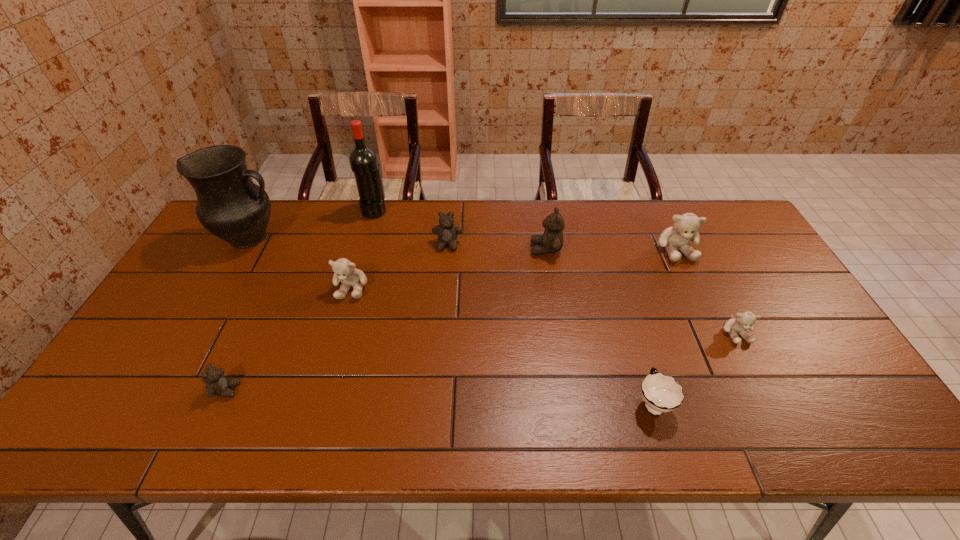
Identify which object is located as the seventh nearest to the biggest gray teddy bear. Please provide its 2D coordinates. Your answer should be formatted as a tuple, i.e. [(x, y)], where the tuple contains the x and y coordinates of a point satisfying the conditions above.

[(230, 205)]

Locate which teddy bear is the third closest to the second object from left to right. Please provide its 2D coordinates. Your answer should be formatted as a tuple, i.e. [(x, y)], where the tuple contains the x and y coordinates of a point satisfying the conditions above.

[(551, 241)]

Select which teddy bear appears as the closest to the leftmost object. Please provide its 2D coordinates. Your answer should be formatted as a tuple, i.e. [(x, y)], where the tuple contains the x and y coordinates of a point satisfying the conditions above.

[(344, 270)]

Find the location of a particular element. This screenshot has height=540, width=960. brown teddy bear that is the nearest to the leftmost teddy bear is located at coordinates pyautogui.click(x=447, y=232).

Identify which brown teddy bear is the closest to the leftmost brown teddy bear. Please provide its 2D coordinates. Your answer should be formatted as a tuple, i.e. [(x, y)], where the tuple contains the x and y coordinates of a point satisfying the conditions above.

[(447, 232)]

At what (x,y) coordinates should I click in order to perform the action: click on the closest gray teddy bear to the red wine bottle. Please return your answer as a coordinate pair (x, y). Looking at the image, I should click on (344, 270).

Point out which gray teddy bear is positioned as the second nearest to the second biggest gray teddy bear. Please provide its 2D coordinates. Your answer should be formatted as a tuple, i.e. [(x, y)], where the tuple contains the x and y coordinates of a point satisfying the conditions above.

[(745, 320)]

The width and height of the screenshot is (960, 540). Find the location of `vacant space that satisfies the following two spatial constraints: 1. on the face of the nearest gray teddy bear; 2. on the face of the leftmost brown teddy bear`. vacant space that satisfies the following two spatial constraints: 1. on the face of the nearest gray teddy bear; 2. on the face of the leftmost brown teddy bear is located at coordinates (765, 390).

The image size is (960, 540). What are the coordinates of `vacant space that satisfies the following two spatial constraints: 1. on the face of the second nearest gray teddy bear; 2. on the face of the nearest brown teddy bear` in the screenshot? It's located at (323, 390).

Where is `free point that satisfies the following two spatial constraints: 1. on the handle side of the pitcher; 2. on the side of the cup with the handle`? This screenshot has height=540, width=960. free point that satisfies the following two spatial constraints: 1. on the handle side of the pitcher; 2. on the side of the cup with the handle is located at coordinates (157, 402).